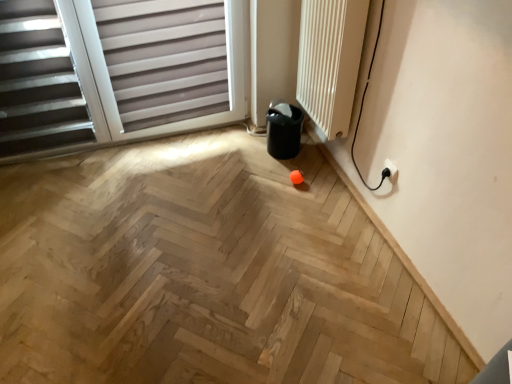
Question: Considering their positions, is white textured radiator at upper right located in front of or behind matte gray blinds at upper left?

Choices:
 (A) front
 (B) behind

Answer: (A)

Question: Choose the correct answer: Is white textured radiator at upper right inside matte gray blinds at upper left or outside it?

Choices:
 (A) outside
 (B) inside

Answer: (A)

Question: Based on their relative distances, which object is nearer to the white textured radiator at upper right?

Choices:
 (A) natural wood floor at center
 (B) white plastic electric outlet at lower right
 (C) matte gray blinds at upper left

Answer: (B)

Question: Considering the real-world distances, which object is closest to the white plastic electric outlet at lower right?

Choices:
 (A) natural wood floor at center
 (B) white textured radiator at upper right
 (C) matte gray blinds at upper left

Answer: (B)